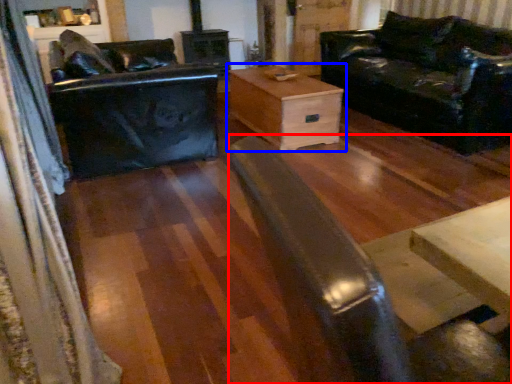
Question: Among these objects, which one is farthest to the camera, wide (highlighted by a red box) or table (highlighted by a blue box)?

Choices:
 (A) wide
 (B) table

Answer: (B)